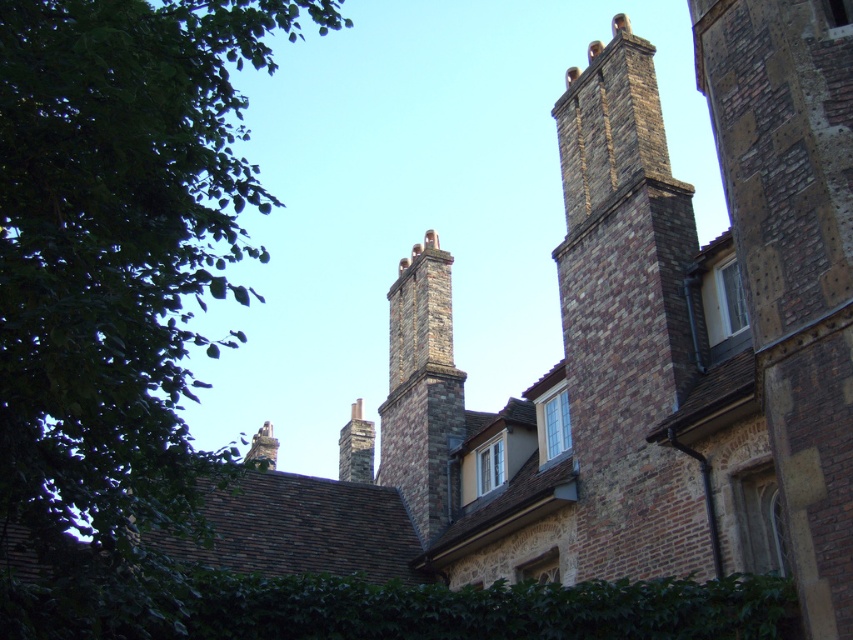
You are an architect evaluating the structural integrity of the building. You notice the brown brick chimney at upper right and the stone chimney at center. Which chimney has a larger footprint in terms of base area?

The brown brick chimney at upper right has a larger footprint in terms of base area than the stone chimney at center because it is bigger.

You are an architect examining the historic brick building. You notice two chimneys, the stone chimney at center and the smooth stone chimney at upper center. Which chimney is located above the other?

The stone chimney at center is positioned over the smooth stone chimney at upper center, meaning the stone chimney at center is above the smooth stone chimney at upper center.